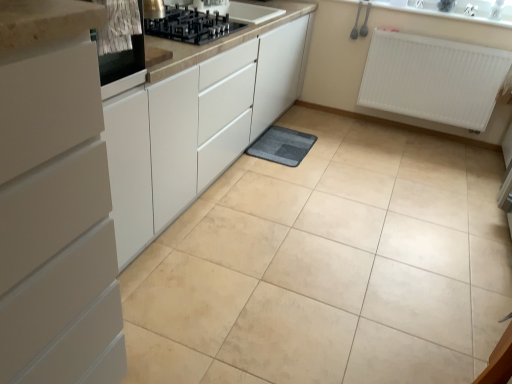
Question: Would you consider metallic stainless steel oven at upper left to be distant from white matte cabinet at left?

Choices:
 (A) yes
 (B) no

Answer: (B)

Question: Can you confirm if metallic stainless steel oven at upper left is positioned to the left of white matte cabinet at left?

Choices:
 (A) no
 (B) yes

Answer: (A)

Question: Is metallic stainless steel oven at upper left outside of white matte cabinet at left?

Choices:
 (A) no
 (B) yes

Answer: (B)

Question: Considering the relative sizes of metallic stainless steel oven at upper left and white matte cabinet at left in the image provided, is metallic stainless steel oven at upper left taller than white matte cabinet at left?

Choices:
 (A) no
 (B) yes

Answer: (A)

Question: Is metallic stainless steel oven at upper left behind white matte cabinet at left?

Choices:
 (A) yes
 (B) no

Answer: (A)

Question: Considering the positions of metallic stainless steel oven at upper left and white plastic radiator at upper right in the image, is metallic stainless steel oven at upper left taller or shorter than white plastic radiator at upper right?

Choices:
 (A) tall
 (B) short

Answer: (B)

Question: From the image's perspective, is metallic stainless steel oven at upper left positioned above or below white plastic radiator at upper right?

Choices:
 (A) below
 (B) above

Answer: (A)

Question: Is metallic stainless steel oven at upper left bigger or smaller than white plastic radiator at upper right?

Choices:
 (A) small
 (B) big

Answer: (A)

Question: In the image, is metallic stainless steel oven at upper left positioned in front of or behind white plastic radiator at upper right?

Choices:
 (A) front
 (B) behind

Answer: (A)

Question: From the image's perspective, is metallic stainless steel oven at upper left positioned above or below black glass gas stove at upper center?

Choices:
 (A) below
 (B) above

Answer: (A)

Question: Considering the positions of metallic stainless steel oven at upper left and black glass gas stove at upper center in the image, is metallic stainless steel oven at upper left taller or shorter than black glass gas stove at upper center?

Choices:
 (A) short
 (B) tall

Answer: (B)

Question: Would you say metallic stainless steel oven at upper left is to the left or to the right of black glass gas stove at upper center in the picture?

Choices:
 (A) left
 (B) right

Answer: (A)

Question: Considering their positions, is metallic stainless steel oven at upper left located in front of or behind black glass gas stove at upper center?

Choices:
 (A) behind
 (B) front

Answer: (B)

Question: Is gray soft mat at center spatially inside black glass gas stove at upper center, or outside of it?

Choices:
 (A) inside
 (B) outside

Answer: (B)

Question: Is gray soft mat at center in front of or behind black glass gas stove at upper center in the image?

Choices:
 (A) front
 (B) behind

Answer: (B)